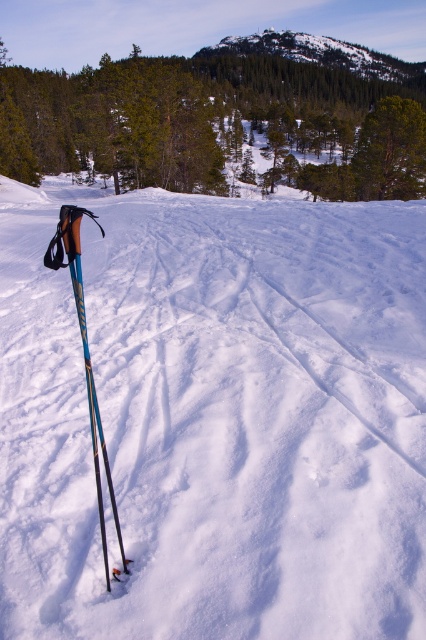
You are standing in the snowy landscape and want to walk towards the snowy rocky hill at upper center and the blue metallic ski pole at left. Which object will you reach first?

You will reach the blue metallic ski pole at left first because it is closer to you than the snowy rocky hill at upper center, which is further away.

You are a photographer standing in the snowy landscape. You want to capture a photo that includes both the white fluffy snow at center and the blue metallic ski pole at left. Which object should you focus on first to ensure both are in sharp focus?

You should focus on the white fluffy snow at center first because it is closer to the viewer than the blue metallic ski pole at left. By focusing on the closer object, the depth of field may extend to include the farther object in acceptable focus.

You are a hiker trying to navigate through the snowy landscape. You see the white fluffy snow at center and the snowy rocky hill at upper center. Which object is positioned to the left of the other?

The white fluffy snow at center is to the left of the snowy rocky hill at upper center.